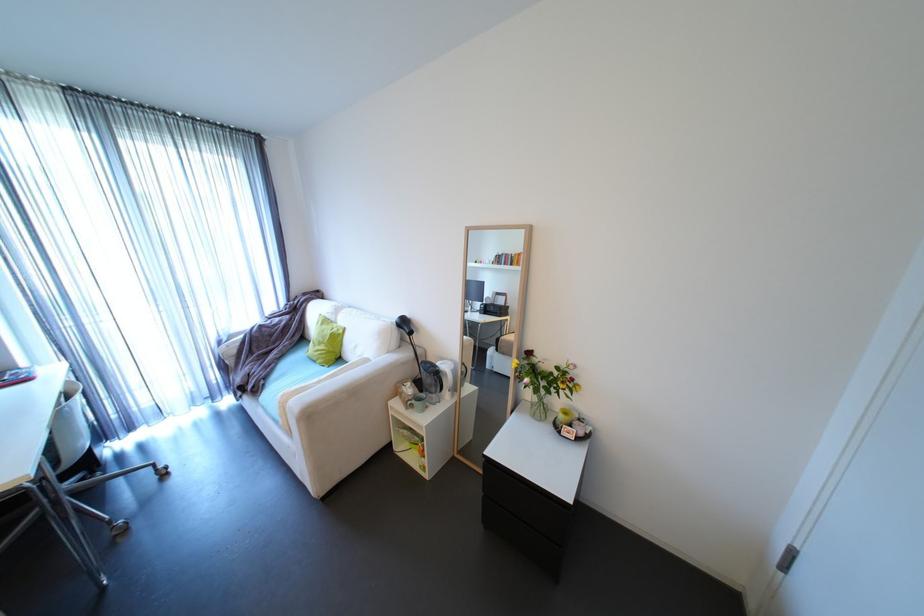
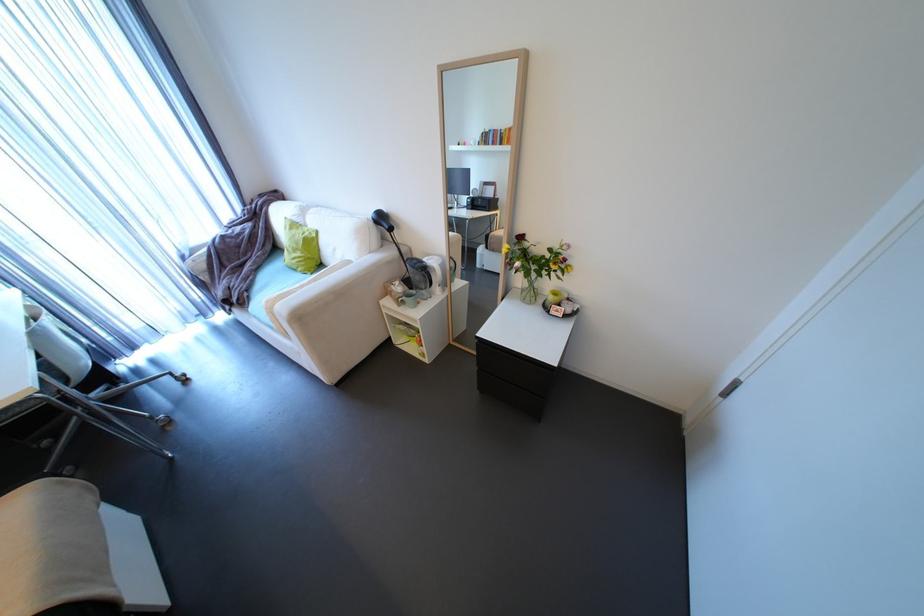
In the second image, find the point that corresponds to (532,355) in the first image.

(524, 241)